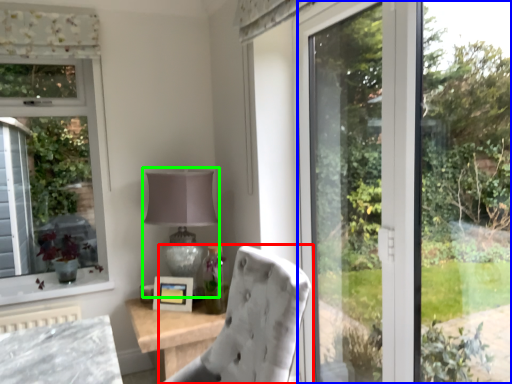
Question: Estimate the real-world distances between objects in this image. Which object is closer to chair (highlighted by a red box), glass door (highlighted by a blue box) or table lamp (highlighted by a green box)?

Choices:
 (A) glass door
 (B) table lamp

Answer: (A)